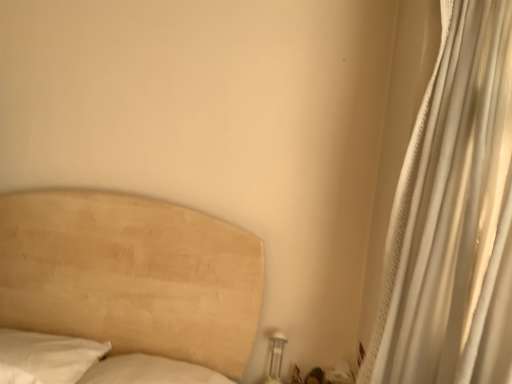
What do you see at coordinates (454, 218) in the screenshot? I see `white textured curtain at right` at bounding box center [454, 218].

The image size is (512, 384). I want to click on white textured curtain at right, so coord(454,218).

In order to face white glossy table lamp at lower right, should I rotate leftwards or rightwards?

To face it directly, rotate right by 2.925 degrees.

Looking at this image, what is the approximate width of white glossy table lamp at lower right?

10.57 centimeters.

The image size is (512, 384). Find the location of `white glossy table lamp at lower right`. white glossy table lamp at lower right is located at coordinates pos(276,357).

The width and height of the screenshot is (512, 384). Describe the element at coordinates (276, 357) in the screenshot. I see `white glossy table lamp at lower right` at that location.

At what (x,y) coordinates should I click in order to perform the action: click on white textured curtain at right. Please return your answer as a coordinate pair (x, y). Looking at the image, I should click on (454, 218).

From the picture: Can you confirm if white glossy table lamp at lower right is positioned to the left of white textured curtain at right?

Yes.

Looking at this image, is white glossy table lamp at lower right further to camera compared to white textured curtain at right?

Yes, white glossy table lamp at lower right is further from the camera.

Which point is more distant from viewer, (271, 382) or (449, 114)?

The point (271, 382) is farther from the camera.

From the image's perspective, is white glossy table lamp at lower right positioned above or below white textured curtain at right?

white glossy table lamp at lower right is situated lower than white textured curtain at right in the image.

From a real-world perspective, is white glossy table lamp at lower right above or below white textured curtain at right?

In terms of real-world spatial position, white glossy table lamp at lower right is below white textured curtain at right.

Which object is wider, white glossy table lamp at lower right or white textured curtain at right?

With larger width is white textured curtain at right.

Considering the sizes of white glossy table lamp at lower right and white textured curtain at right in the image, is white glossy table lamp at lower right taller or shorter than white textured curtain at right?

In the image, white glossy table lamp at lower right appears to be shorter than white textured curtain at right.

Which of these two, white glossy table lamp at lower right or white textured curtain at right, is bigger?

With larger size is white textured curtain at right.

Looking at this image, can we say white glossy table lamp at lower right lies outside white textured curtain at right?

That's correct, white glossy table lamp at lower right is outside of white textured curtain at right.

Is white glossy table lamp at lower right in contact with white textured curtain at right?

No, white glossy table lamp at lower right is not touching white textured curtain at right.

Is white glossy table lamp at lower right turned away from white textured curtain at right?

white glossy table lamp at lower right is not turned away from white textured curtain at right.

At what (x,y) coordinates should I click in order to perform the action: click on table lamp below the white textured curtain at right (from the image's perspective). Please return your answer as a coordinate pair (x, y). Looking at the image, I should click on (276, 357).

Considering the relative positions of white textured curtain at right and white glossy table lamp at lower right in the image provided, is white textured curtain at right to the left of white glossy table lamp at lower right from the viewer's perspective?

In fact, white textured curtain at right is to the right of white glossy table lamp at lower right.

Which object is further away from the camera taking this photo, white textured curtain at right or white glossy table lamp at lower right?

white glossy table lamp at lower right is further from the camera.

Between point (450, 216) and point (275, 358), which one is positioned in front?

The point (450, 216) is closer to the camera.

From the image's perspective, who appears lower, white textured curtain at right or white glossy table lamp at lower right?

white glossy table lamp at lower right.

Consider the image. From a real-world perspective, who is located lower, white textured curtain at right or white glossy table lamp at lower right?

white glossy table lamp at lower right.

Consider the image. Can you confirm if white textured curtain at right is thinner than white glossy table lamp at lower right?

No, white textured curtain at right is not thinner than white glossy table lamp at lower right.

Which of these two, white textured curtain at right or white glossy table lamp at lower right, stands shorter?

white glossy table lamp at lower right.

Considering the sizes of objects white textured curtain at right and white glossy table lamp at lower right in the image provided, who is bigger, white textured curtain at right or white glossy table lamp at lower right?

white textured curtain at right.

Could white glossy table lamp at lower right be considered to be inside white textured curtain at right?

No, white glossy table lamp at lower right is not inside white textured curtain at right.

In the scene shown: Is white textured curtain at right far away from white glossy table lamp at lower right?

That's not correct — white textured curtain at right is a little close to white glossy table lamp at lower right.

Does white textured curtain at right turn towards white glossy table lamp at lower right?

No, white textured curtain at right is not facing towards white glossy table lamp at lower right.

How many degrees apart are the facing directions of white textured curtain at right and white glossy table lamp at lower right?

The facing directions of white textured curtain at right and white glossy table lamp at lower right are 41.8 degrees apart.

Looking at this image, measure the distance from white textured curtain at right to white glossy table lamp at lower right.

39.21 inches.

This screenshot has height=384, width=512. I want to click on table lamp that is behind the white textured curtain at right, so click(x=276, y=357).

Where is `table lamp that is under the white textured curtain at right (from a real-world perspective)`? table lamp that is under the white textured curtain at right (from a real-world perspective) is located at coordinates (276, 357).

This screenshot has width=512, height=384. Identify the location of table lamp that is below the white textured curtain at right (from the image's perspective). (276, 357).